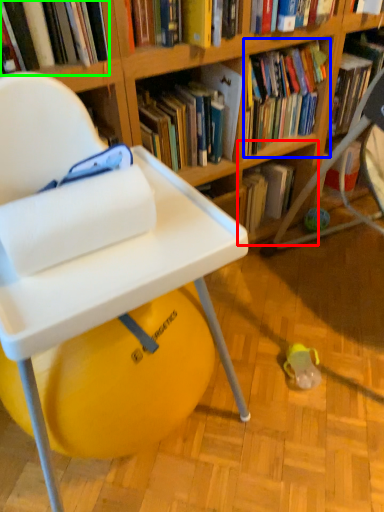
Question: Which object is positioned farthest from shelf (highlighted by a red box)? Select from book (highlighted by a blue box) and book (highlighted by a green box).

Choices:
 (A) book
 (B) book

Answer: (B)